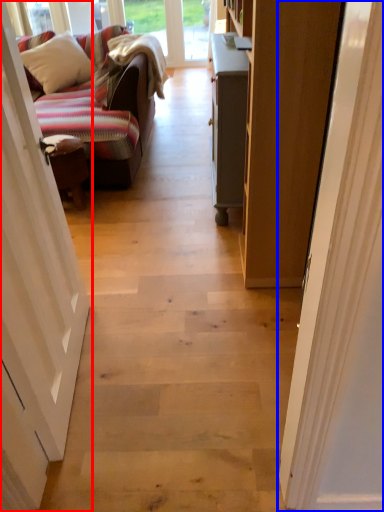
Question: Which of the following is the farthest to the observer, door (highlighted by a red box) or door (highlighted by a blue box)?

Choices:
 (A) door
 (B) door

Answer: (B)